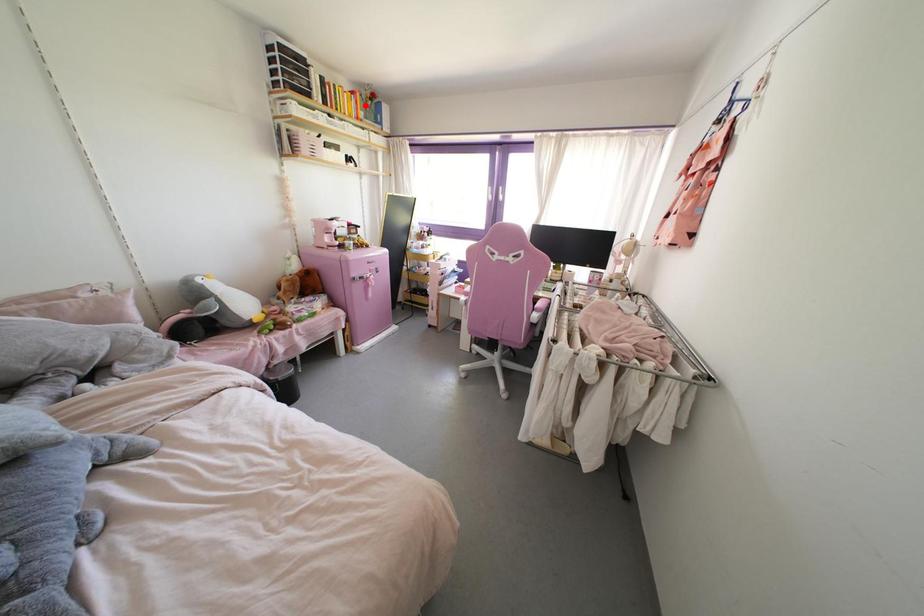
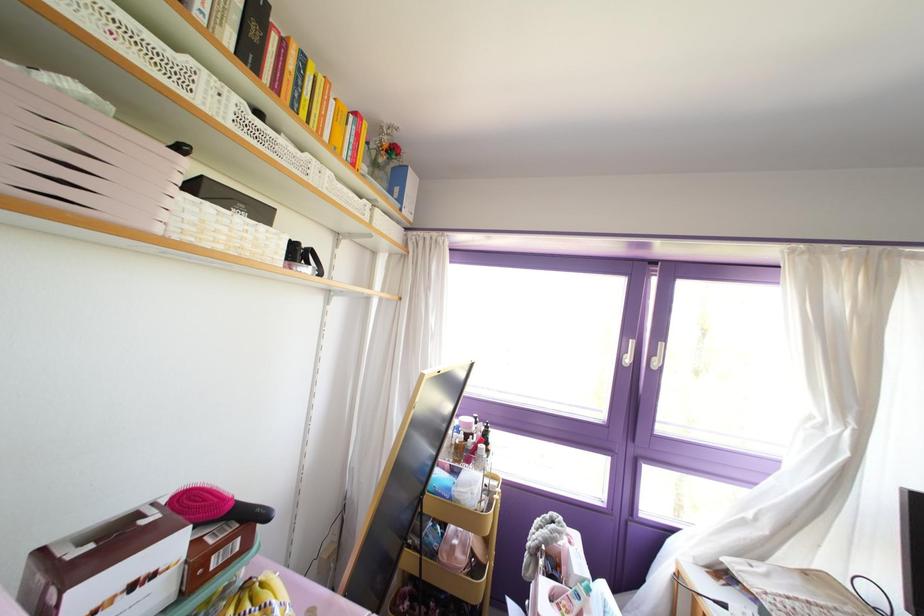
Question: I am providing you with two images of the same scene from different viewpoints. A red point is marked on the first image. Can you still see the location of the red point in image 2?

Choices:
 (A) Yes
 (B) No

Answer: (A)